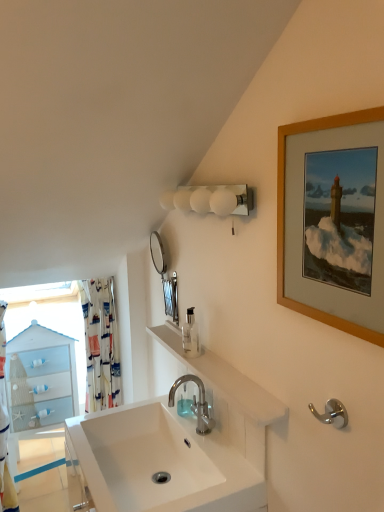
Where is `free spot above white glossy sink at center (from a real-world perspective)`? The height and width of the screenshot is (512, 384). free spot above white glossy sink at center (from a real-world perspective) is located at coordinates (224, 367).